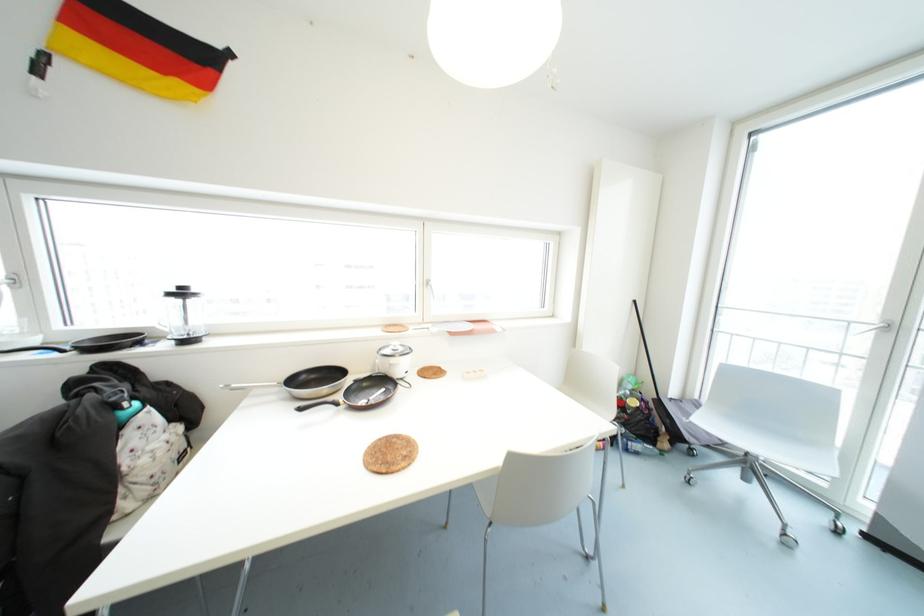
Image resolution: width=924 pixels, height=616 pixels. I want to click on white pot, so click(x=394, y=360).